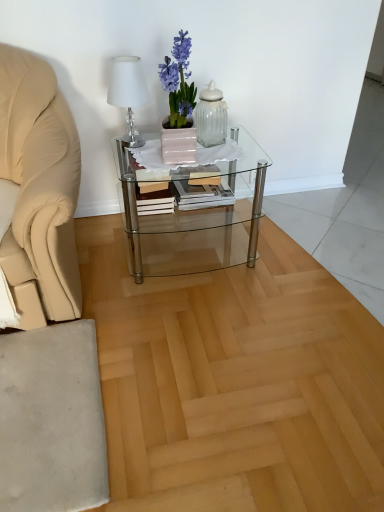
Identify the location of empty space that is to the right of clear glass coffee table at center. (296, 249).